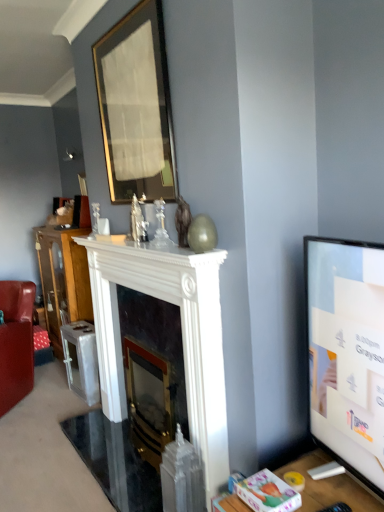
In order to face flat screen tv at right, should I rotate leftwards or rightwards?

You should rotate right by 19.653 degrees.

Measure the distance between point (156, 450) and camera.

Point (156, 450) and camera are 7.07 feet apart.

The image size is (384, 512). I want to click on polished brass fireplace at center, the second fireplace when ordered from front to back, so click(152, 371).

Measure the distance between leather armchair at lower left and camera.

The depth of leather armchair at lower left is 9.18 feet.

In order to click on wooden cabinet at left in this screenshot , I will do `click(63, 279)`.

Image resolution: width=384 pixels, height=512 pixels. What do you see at coordinates (63, 279) in the screenshot? I see `wooden cabinet at left` at bounding box center [63, 279].

At what (x,y) coordinates should I click in order to perform the action: click on flat screen tv at right. Please return your answer as a coordinate pair (x, y). The height and width of the screenshot is (512, 384). Looking at the image, I should click on (347, 352).

Is matte white vase at center aimed at flat screen tv at right?

No, matte white vase at center is not aimed at flat screen tv at right.

Where is `television below the matte white vase at center (from the image's perspective)`? television below the matte white vase at center (from the image's perspective) is located at coordinates (347, 352).

Is matte white vase at center taller than flat screen tv at right?

In fact, matte white vase at center may be shorter than flat screen tv at right.

Which object is closer to the camera taking this photo, flat screen tv at right or leather armchair at lower left?

flat screen tv at right is more forward.

Can you confirm if flat screen tv at right is bigger than leather armchair at lower left?

No, flat screen tv at right is not bigger than leather armchair at lower left.

Is flat screen tv at right facing towards leather armchair at lower left?

No, flat screen tv at right is not aimed at leather armchair at lower left.

What's the angular difference between flat screen tv at right and leather armchair at lower left's facing directions?

There is a 57.2-degree angle between the facing directions of flat screen tv at right and leather armchair at lower left.

Is matte white vase at center directly adjacent to white glossy fireplace at center, which appears as the 2th fireplace when viewed from the back?

matte white vase at center and white glossy fireplace at center, which appears as the 2th fireplace when viewed from the back, are clearly separated.

Relative to white glossy fireplace at center, the 1th fireplace in the front-to-back sequence, is matte white vase at center in front or behind?

Visually, matte white vase at center is located behind white glossy fireplace at center, the 1th fireplace in the front-to-back sequence.

Can white glossy fireplace at center, which appears as the 2th fireplace when viewed from the back, be found inside matte white vase at center?

No, white glossy fireplace at center, which appears as the 2th fireplace when viewed from the back, is not inside matte white vase at center.

Do you think polished brass fireplace at center, which ranks as the first fireplace in back-to-front order, is within gold-framed mirror at upper center, or outside of it?

polished brass fireplace at center, which ranks as the first fireplace in back-to-front order, lies outside gold-framed mirror at upper center.

How many degrees apart are the facing directions of polished brass fireplace at center, which ranks as the first fireplace in back-to-front order, and gold-framed mirror at upper center?

They differ by 0.543 degrees in their facing directions.

Is polished brass fireplace at center, which ranks as the first fireplace in back-to-front order, at the left side of gold-framed mirror at upper center?

No.

Does polished brass fireplace at center, the second fireplace when ordered from front to back, turn towards gold-framed mirror at upper center?

No, polished brass fireplace at center, the second fireplace when ordered from front to back, is not turned towards gold-framed mirror at upper center.

Does gold-framed mirror at upper center have a smaller size compared to polished brass fireplace at center, which ranks as the first fireplace in back-to-front order?

Incorrect, gold-framed mirror at upper center is not smaller in size than polished brass fireplace at center, which ranks as the first fireplace in back-to-front order.

Consider the image. How many degrees apart are the facing directions of gold-framed mirror at upper center and polished brass fireplace at center, the second fireplace when ordered from front to back?

They differ by 0.543 degrees in their facing directions.

Is gold-framed mirror at upper center directly adjacent to polished brass fireplace at center, the second fireplace when ordered from front to back?

There is a gap between gold-framed mirror at upper center and polished brass fireplace at center, the second fireplace when ordered from front to back.

From the image's perspective, which is above, gold-framed mirror at upper center or polished brass fireplace at center, which ranks as the first fireplace in back-to-front order?

gold-framed mirror at upper center is shown above in the image.

Does leather armchair at lower left turn towards flat screen tv at right?

No, leather armchair at lower left is not facing towards flat screen tv at right.

Would you say leather armchair at lower left is outside flat screen tv at right?

That's correct, leather armchair at lower left is outside of flat screen tv at right.

Does point (22, 326) appear closer or farther from the camera than point (364, 400)?

Clearly, point (22, 326) is more distant from the camera than point (364, 400).

Looking at their sizes, would you say leather armchair at lower left is wider or thinner than flat screen tv at right?

Considering their sizes, leather armchair at lower left looks broader than flat screen tv at right.

Which object is closer to the camera, polished brass fireplace at center, which ranks as the first fireplace in back-to-front order, or wooden cabinet at left?

polished brass fireplace at center, which ranks as the first fireplace in back-to-front order, is in front.

Which is closer, (168, 364) or (72, 276)?

Point (168, 364) is positioned closer to the camera compared to point (72, 276).

From a real-world perspective, is polished brass fireplace at center, the second fireplace when ordered from front to back, on top of wooden cabinet at left?

Actually, polished brass fireplace at center, the second fireplace when ordered from front to back, is physically below wooden cabinet at left in the real world.

Is polished brass fireplace at center, the second fireplace when ordered from front to back, far from wooden cabinet at left?

Indeed, polished brass fireplace at center, the second fireplace when ordered from front to back, is not near wooden cabinet at left.

At what (x,y) coordinates should I click in order to perform the action: click on coffee cup above the flat screen tv at right (from a real-world perspective). Please return your answer as a coordinate pair (x, y). The image size is (384, 512). Looking at the image, I should click on (103, 226).

This screenshot has height=512, width=384. Find the location of `chair below the flat screen tv at right (from the image's perspective)`. chair below the flat screen tv at right (from the image's perspective) is located at coordinates (16, 342).

Which object lies nearer to the anchor point wooden cabinet at left, flat screen tv at right or gold-framed mirror at upper center?

Among the two, gold-framed mirror at upper center is located nearer to wooden cabinet at left.

When comparing their distances from white glossy fireplace at center, which appears as the 2th fireplace when viewed from the back, does polished brass fireplace at center, which ranks as the first fireplace in back-to-front order, or leather armchair at lower left seem closer?

polished brass fireplace at center, which ranks as the first fireplace in back-to-front order, lies closer to white glossy fireplace at center, which appears as the 2th fireplace when viewed from the back, than the other object.

Estimate the real-world distances between objects in this image. Which object is closer to white glossy fireplace at center, which appears as the 2th fireplace when viewed from the back, matte white vase at center or polished brass fireplace at center, which ranks as the first fireplace in back-to-front order?

Among the two, polished brass fireplace at center, which ranks as the first fireplace in back-to-front order, is located nearer to white glossy fireplace at center, which appears as the 2th fireplace when viewed from the back.

Estimate the real-world distances between objects in this image. Which object is further from white glossy fireplace at center, the 1th fireplace in the front-to-back sequence, wooden cabinet at left or gold-framed mirror at upper center?

wooden cabinet at left lies further to white glossy fireplace at center, the 1th fireplace in the front-to-back sequence, than the other object.

Consider the image. Considering their positions, is flat screen tv at right positioned further to polished brass fireplace at center, the second fireplace when ordered from front to back, than gold-framed mirror at upper center?

Among the two, gold-framed mirror at upper center is located further to polished brass fireplace at center, the second fireplace when ordered from front to back.

Considering their positions, is leather armchair at lower left positioned further to gold-framed mirror at upper center than flat screen tv at right?

leather armchair at lower left is further to gold-framed mirror at upper center.

Considering their positions, is matte white vase at center positioned closer to white glossy fireplace at center, the 1th fireplace in the front-to-back sequence, than gold-framed mirror at upper center?

The object closer to white glossy fireplace at center, the 1th fireplace in the front-to-back sequence, is gold-framed mirror at upper center.

Based on the photo, looking at the image, which one is located further to leather armchair at lower left, gold-framed mirror at upper center or white glossy fireplace at center, which appears as the 2th fireplace when viewed from the back?

gold-framed mirror at upper center is positioned further to the anchor leather armchair at lower left.

Locate an element on the screen. chair between polished brass fireplace at center, the second fireplace when ordered from front to back, and wooden cabinet at left in the front-back direction is located at coordinates (16, 342).

I want to click on coffee cup between gold-framed mirror at upper center and leather armchair at lower left in the vertical direction, so click(103, 226).

Find the location of a particular element. coffee cup between polished brass fireplace at center, which ranks as the first fireplace in back-to-front order, and wooden cabinet at left, along the z-axis is located at coordinates [x=103, y=226].

You are a GUI agent. You are given a task and a screenshot of the screen. Output one action in this format:
    pyautogui.click(x=<x>, y=<y>)
    Task: Click on the fireplace between matte white vase at center and polished brass fireplace at center, which ranks as the first fireplace in back-to-front order, in the up-down direction
    
    Given the screenshot: What is the action you would take?
    pyautogui.click(x=181, y=329)